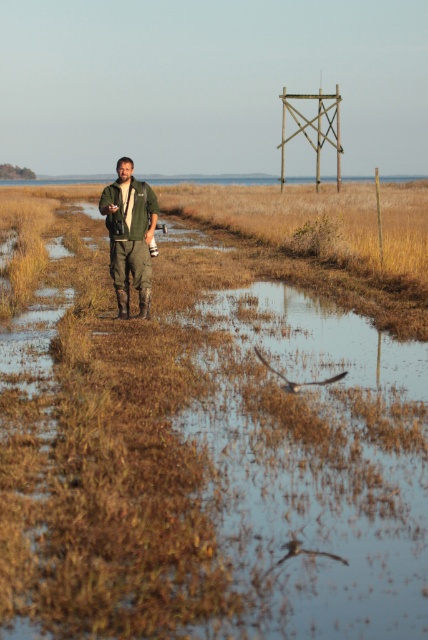
Based on the scene, can you determine if the brown grassy wetland at center is wider than the green matte jacket at center?

The brown grassy wetland at center is wider than the green matte jacket at center according to the description.

You are standing at the edge of the waterway in the scene. The brown grassy wetland at center is at point (214, 420). If you want to reach that exact point, which direction should you move relative to your current position?

The brown grassy wetland at center is located at point (214, 420), so you should move towards that coordinate to reach it.